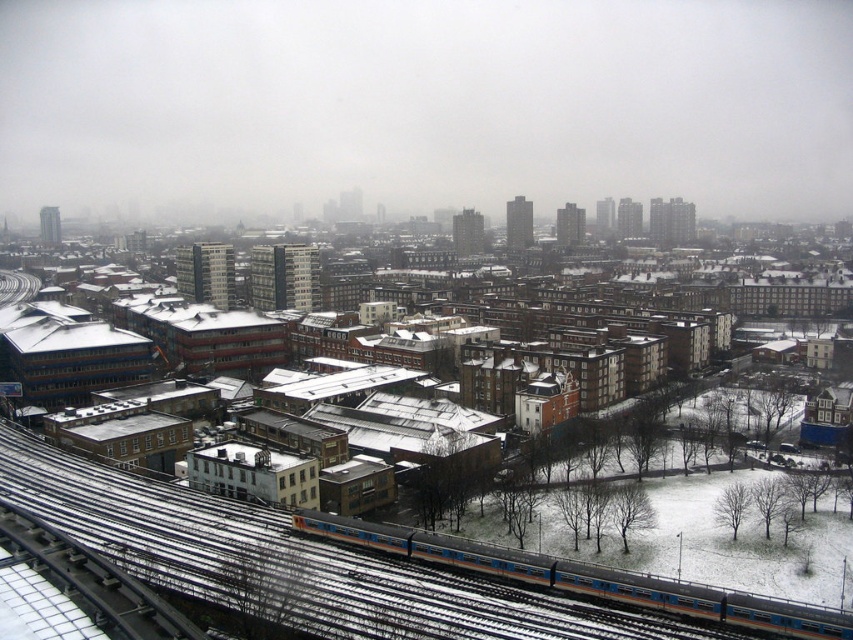
Between blue metallic train at lower center and metallic silver train track at lower left, which one appears on the right side from the viewer's perspective?

Positioned to the right is blue metallic train at lower center.

Which is more to the left, blue metallic train at lower center or metallic silver train track at lower left?

From the viewer's perspective, metallic silver train track at lower left appears more on the left side.

What do you see at coordinates (585, 577) in the screenshot? The width and height of the screenshot is (853, 640). I see `blue metallic train at lower center` at bounding box center [585, 577].

Image resolution: width=853 pixels, height=640 pixels. I want to click on blue metallic train at lower center, so click(x=585, y=577).